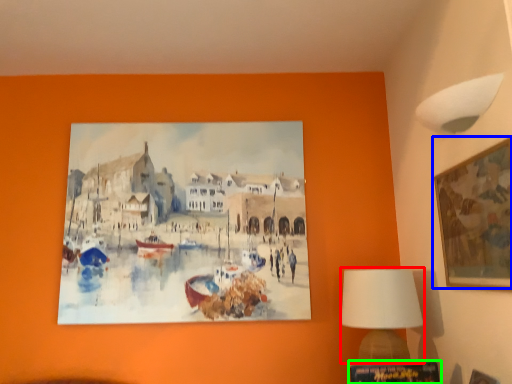
Question: Which object is positioned farthest from table lamp (highlighted by a red box)? Select from picture frame (highlighted by a blue box) and picture frame (highlighted by a green box).

Choices:
 (A) picture frame
 (B) picture frame

Answer: (A)